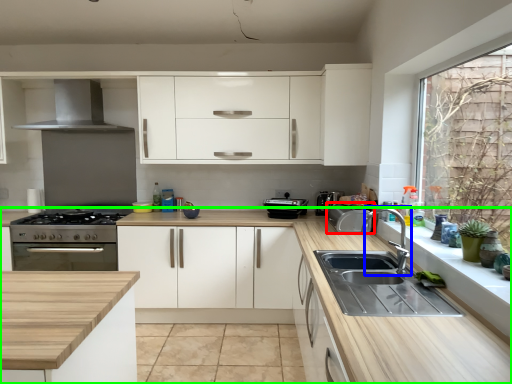
Question: Which is nearer to the appliance (highlighted by a red box)? tap (highlighted by a blue box) or countertop (highlighted by a green box).

Choices:
 (A) tap
 (B) countertop

Answer: (A)